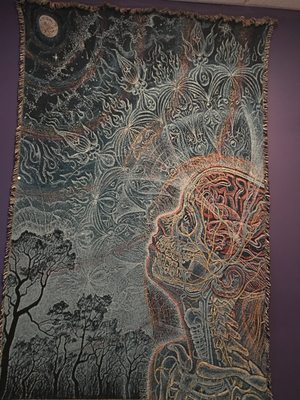
The height and width of the screenshot is (400, 300). I want to click on edging of the carpet on the upper left hand side, so click(x=22, y=6).